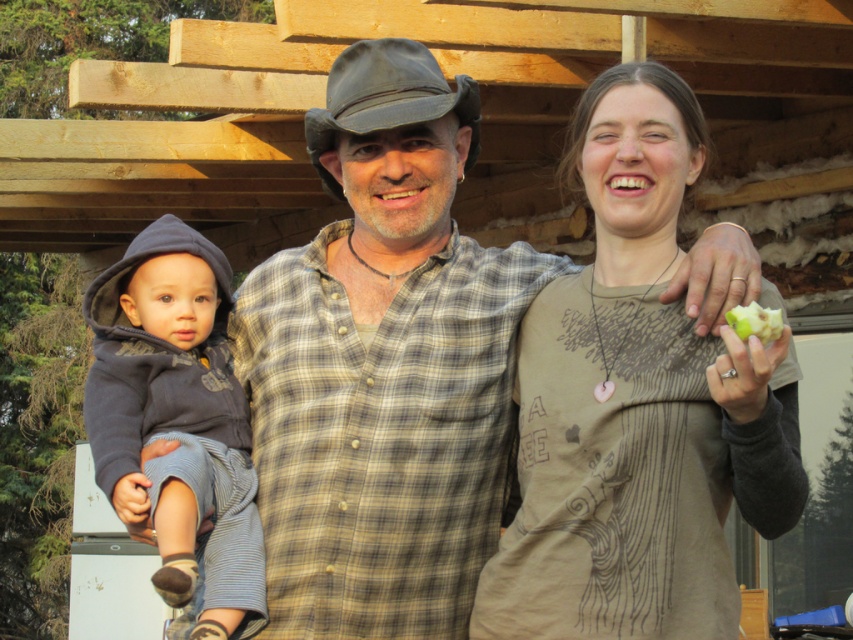
Which is in front, point (206, 595) or point (772, 330)?

Point (772, 330)

From the picture: Does dark gray fleece hoodie at left have a greater height compared to green matte apple at upper right?

Indeed, dark gray fleece hoodie at left has a greater height compared to green matte apple at upper right.

Which is in front, point (152, 234) or point (773, 326)?

Positioned in front is point (773, 326).

The width and height of the screenshot is (853, 640). What are the coordinates of `dark gray fleece hoodie at left` in the screenshot? It's located at (178, 419).

Does matte brown sweater at center have a greater width compared to green matte apple at upper right?

Indeed, matte brown sweater at center has a greater width compared to green matte apple at upper right.

Between matte brown sweater at center and green matte apple at upper right, which one has more height?

matte brown sweater at center

Between point (590, 307) and point (763, 310), which one is positioned in front?

Point (763, 310) is in front.

Identify the location of matte brown sweater at center. Image resolution: width=853 pixels, height=640 pixels. (636, 406).

Who is more distant from viewer, (590, 180) or (206, 269)?

Point (206, 269)

Is point (686, 595) in front of point (242, 477)?

Yes, point (686, 595) is closer to viewer.

Where is `matte brown sweater at center`? matte brown sweater at center is located at coordinates (636, 406).